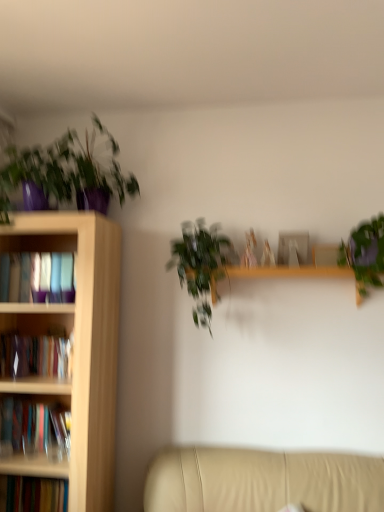
Where is `green matte plant at upper right, which is counted as the fourth houseplant, starting from the left`? green matte plant at upper right, which is counted as the fourth houseplant, starting from the left is located at coordinates (365, 255).

This screenshot has width=384, height=512. I want to click on green leafy plant at center, which ranks as the second houseplant in right-to-left order, so click(x=200, y=265).

Identify the location of wooden bookcase at left. The height and width of the screenshot is (512, 384). (75, 347).

This screenshot has width=384, height=512. What do you see at coordinates (75, 347) in the screenshot? I see `wooden bookcase at left` at bounding box center [75, 347].

In order to click on green matte plant at upper right, which is counted as the fourth houseplant, starting from the left in this screenshot , I will do `click(365, 255)`.

Considering the relative sizes of matte purple pot at upper left, marked as the fourth houseplant in a right-to-left arrangement, and matte purple pot at upper left, which is counted as the third houseplant, starting from the right, in the image provided, is matte purple pot at upper left, marked as the fourth houseplant in a right-to-left arrangement, wider than matte purple pot at upper left, which is counted as the third houseplant, starting from the right,?

Incorrect, the width of matte purple pot at upper left, marked as the fourth houseplant in a right-to-left arrangement, does not surpass that of matte purple pot at upper left, which is counted as the third houseplant, starting from the right.

Which object is positioned more to the right, matte purple pot at upper left, which is the 1th houseplant in left-to-right order, or matte purple pot at upper left, which is the 2th houseplant from left to right?

matte purple pot at upper left, which is the 2th houseplant from left to right, is more to the right.

From the image's perspective, is matte purple pot at upper left, which is the 1th houseplant in left-to-right order, above or below matte purple pot at upper left, which is counted as the third houseplant, starting from the right?

Result: Clearly, from the image's perspective, matte purple pot at upper left, which is the 1th houseplant in left-to-right order, is below matte purple pot at upper left, which is counted as the third houseplant, starting from the right.

Considering the sizes of matte purple pot at upper left, marked as the fourth houseplant in a right-to-left arrangement, and matte purple pot at upper left, which is the 2th houseplant from left to right, in the image, is matte purple pot at upper left, marked as the fourth houseplant in a right-to-left arrangement, taller or shorter than matte purple pot at upper left, which is the 2th houseplant from left to right,?

Considering their sizes, matte purple pot at upper left, marked as the fourth houseplant in a right-to-left arrangement, has less height than matte purple pot at upper left, which is the 2th houseplant from left to right.

Considering the relative sizes of matte purple pot at upper left, which is the 2th houseplant from left to right, and green leafy plant at center, which ranks as the second houseplant in right-to-left order, in the image provided, is matte purple pot at upper left, which is the 2th houseplant from left to right, smaller than green leafy plant at center, which ranks as the second houseplant in right-to-left order,?

Actually, matte purple pot at upper left, which is the 2th houseplant from left to right, might be larger than green leafy plant at center, which ranks as the second houseplant in right-to-left order.

Considering the positions of objects matte purple pot at upper left, which is counted as the third houseplant, starting from the right, and green leafy plant at center, which ranks as the second houseplant in right-to-left order, in the image provided, who is behind, matte purple pot at upper left, which is counted as the third houseplant, starting from the right, or green leafy plant at center, which ranks as the second houseplant in right-to-left order,?

Positioned behind is green leafy plant at center, which ranks as the second houseplant in right-to-left order.

Is matte purple pot at upper left, which is the 2th houseplant from left to right, not near green leafy plant at center, which ranks as the second houseplant in right-to-left order?

No, there isn't a large distance between matte purple pot at upper left, which is the 2th houseplant from left to right, and green leafy plant at center, which ranks as the second houseplant in right-to-left order.

Consider the image. From the image's perspective, which one is positioned higher, matte purple pot at upper left, which is the 2th houseplant from left to right, or green leafy plant at center, which ranks as the second houseplant in right-to-left order?

matte purple pot at upper left, which is the 2th houseplant from left to right.

From the image's perspective, is matte purple pot at upper left, marked as the fourth houseplant in a right-to-left arrangement, located above or below green leafy plant at center, which ranks as the second houseplant in right-to-left order?

matte purple pot at upper left, marked as the fourth houseplant in a right-to-left arrangement, is situated higher than green leafy plant at center, which ranks as the second houseplant in right-to-left order, in the image.

From a real-world perspective, is matte purple pot at upper left, marked as the fourth houseplant in a right-to-left arrangement, below green leafy plant at center, which ranks as the second houseplant in right-to-left order?

No, from a real-world perspective, matte purple pot at upper left, marked as the fourth houseplant in a right-to-left arrangement, is not under green leafy plant at center, which ranks as the second houseplant in right-to-left order.

How much distance is there between matte purple pot at upper left, which is the 1th houseplant in left-to-right order, and green leafy plant at center, which appears as the 3th houseplant when viewed from the left?

The distance of matte purple pot at upper left, which is the 1th houseplant in left-to-right order, from green leafy plant at center, which appears as the 3th houseplant when viewed from the left, is 32.40 inches.

Looking at this image, is matte purple pot at upper left, which is the 1th houseplant in left-to-right order, oriented towards green leafy plant at center, which ranks as the second houseplant in right-to-left order?

No, matte purple pot at upper left, which is the 1th houseplant in left-to-right order, is not turned towards green leafy plant at center, which ranks as the second houseplant in right-to-left order.

Who is shorter, matte purple pot at upper left, which is counted as the third houseplant, starting from the right, or beige leather couch at lower right?

beige leather couch at lower right.

In the scene shown: Considering the sizes of matte purple pot at upper left, which is the 2th houseplant from left to right, and beige leather couch at lower right in the image, is matte purple pot at upper left, which is the 2th houseplant from left to right, wider or thinner than beige leather couch at lower right?

Considering their sizes, matte purple pot at upper left, which is the 2th houseplant from left to right, looks slimmer than beige leather couch at lower right.

Considering the relative sizes of matte purple pot at upper left, which is the 2th houseplant from left to right, and beige leather couch at lower right in the image provided, is matte purple pot at upper left, which is the 2th houseplant from left to right, smaller than beige leather couch at lower right?

Yes, matte purple pot at upper left, which is the 2th houseplant from left to right, is smaller than beige leather couch at lower right.

Is matte purple pot at upper left, which is the 2th houseplant from left to right, far away from beige leather couch at lower right?

That's right, there is a large distance between matte purple pot at upper left, which is the 2th houseplant from left to right, and beige leather couch at lower right.

From a real-world perspective, is wooden bookcase at left physically located above or below green matte plant at upper right, which is counted as the fourth houseplant, starting from the left?

Clearly, from a real-world perspective, wooden bookcase at left is below green matte plant at upper right, which is counted as the fourth houseplant, starting from the left.

Can you tell me how much wooden bookcase at left and green matte plant at upper right, which is counted as the fourth houseplant, starting from the left, differ in facing direction?

The angle between the facing direction of wooden bookcase at left and the facing direction of green matte plant at upper right, which is counted as the fourth houseplant, starting from the left, is 0.000585 degrees.

Which of these two, wooden bookcase at left or green matte plant at upper right, which is counted as the fourth houseplant, starting from the left, stands shorter?

Standing shorter between the two is green matte plant at upper right, which is counted as the fourth houseplant, starting from the left.

Is green matte plant at upper right, which is counted as the fourth houseplant, starting from the left, wider or thinner than matte purple pot at upper left, which is counted as the third houseplant, starting from the right?

Considering their sizes, green matte plant at upper right, which is counted as the fourth houseplant, starting from the left, looks slimmer than matte purple pot at upper left, which is counted as the third houseplant, starting from the right.

From the image's perspective, between green matte plant at upper right, which is counted as the fourth houseplant, starting from the left, and matte purple pot at upper left, which is counted as the third houseplant, starting from the right, who is located below?

green matte plant at upper right, which is counted as the fourth houseplant, starting from the left.

Identify the location of houseplant in front of the green matte plant at upper right, the first houseplant viewed from the right. This screenshot has height=512, width=384. (70, 170).

Which object is positioned more to the right, green matte plant at upper right, the first houseplant viewed from the right, or matte purple pot at upper left, which is counted as the third houseplant, starting from the right?

green matte plant at upper right, the first houseplant viewed from the right.

Which object is further away from the camera, matte purple pot at upper left, which is counted as the third houseplant, starting from the right, or green matte plant at upper right, the first houseplant viewed from the right?

green matte plant at upper right, the first houseplant viewed from the right, is further away from the camera.

From the image's perspective, relative to green matte plant at upper right, the first houseplant viewed from the right, is matte purple pot at upper left, which is the 2th houseplant from left to right, above or below?

Based on their image positions, matte purple pot at upper left, which is the 2th houseplant from left to right, is located above green matte plant at upper right, the first houseplant viewed from the right.

Is matte purple pot at upper left, which is counted as the third houseplant, starting from the right, outside of green matte plant at upper right, which is counted as the fourth houseplant, starting from the left?

That's correct, matte purple pot at upper left, which is counted as the third houseplant, starting from the right, is outside of green matte plant at upper right, which is counted as the fourth houseplant, starting from the left.

Find the location of a particular element. Image resolution: width=384 pixels, height=512 pixels. houseplant on the left of matte purple pot at upper left, which is counted as the third houseplant, starting from the right is located at coordinates 36,175.

Find the location of `the 3rd houseplant behind the matte purple pot at upper left, which is counted as the third houseplant, starting from the right`. the 3rd houseplant behind the matte purple pot at upper left, which is counted as the third houseplant, starting from the right is located at coordinates (200, 265).

Based on their spatial positions, is matte purple pot at upper left, which is the 1th houseplant in left-to-right order, or beige leather couch at lower right closer to matte purple pot at upper left, which is counted as the third houseplant, starting from the right?

matte purple pot at upper left, which is the 1th houseplant in left-to-right order.

Looking at the image, which one is located closer to green matte plant at upper right, the first houseplant viewed from the right, matte purple pot at upper left, which is the 1th houseplant in left-to-right order, or beige leather couch at lower right?

Among the two, beige leather couch at lower right is located nearer to green matte plant at upper right, the first houseplant viewed from the right.

Estimate the real-world distances between objects in this image. Which object is further from matte purple pot at upper left, which is the 2th houseplant from left to right, green matte plant at upper right, the first houseplant viewed from the right, or beige leather couch at lower right?

beige leather couch at lower right.

Based on their spatial positions, is beige leather couch at lower right or green matte plant at upper right, the first houseplant viewed from the right, further from green leafy plant at center, which ranks as the second houseplant in right-to-left order?

beige leather couch at lower right.

Which object lies further to the anchor point green leafy plant at center, which appears as the 3th houseplant when viewed from the left, wooden bookcase at left or beige leather couch at lower right?

beige leather couch at lower right is further to green leafy plant at center, which appears as the 3th houseplant when viewed from the left.

Looking at the image, which one is located further to beige leather couch at lower right, green leafy plant at center, which ranks as the second houseplant in right-to-left order, or green matte plant at upper right, which is counted as the fourth houseplant, starting from the left?

The object further to beige leather couch at lower right is green matte plant at upper right, which is counted as the fourth houseplant, starting from the left.

Looking at the image, which one is located closer to wooden bookcase at left, beige leather couch at lower right or green matte plant at upper right, the first houseplant viewed from the right?

beige leather couch at lower right lies closer to wooden bookcase at left than the other object.

Looking at the image, which one is located closer to green leafy plant at center, which appears as the 3th houseplant when viewed from the left, matte purple pot at upper left, which is the 1th houseplant in left-to-right order, or green matte plant at upper right, which is counted as the fourth houseplant, starting from the left?

green matte plant at upper right, which is counted as the fourth houseplant, starting from the left, lies closer to green leafy plant at center, which appears as the 3th houseplant when viewed from the left, than the other object.

Image resolution: width=384 pixels, height=512 pixels. Find the location of `bookcase located between matte purple pot at upper left, which is the 1th houseplant in left-to-right order, and green matte plant at upper right, which is counted as the fourth houseplant, starting from the left, in the left-right direction`. bookcase located between matte purple pot at upper left, which is the 1th houseplant in left-to-right order, and green matte plant at upper right, which is counted as the fourth houseplant, starting from the left, in the left-right direction is located at coordinates (75, 347).

Identify the location of houseplant between green matte plant at upper right, which is counted as the fourth houseplant, starting from the left, and beige leather couch at lower right in the up-down direction. (200, 265).

I want to click on studio couch between wooden bookcase at left and green matte plant at upper right, which is counted as the fourth houseplant, starting from the left, from left to right, so click(262, 481).

At what (x,y) coordinates should I click in order to perform the action: click on houseplant located between matte purple pot at upper left, which is the 2th houseplant from left to right, and green matte plant at upper right, the first houseplant viewed from the right, in the left-right direction. Please return your answer as a coordinate pair (x, y). Image resolution: width=384 pixels, height=512 pixels. Looking at the image, I should click on pos(200,265).